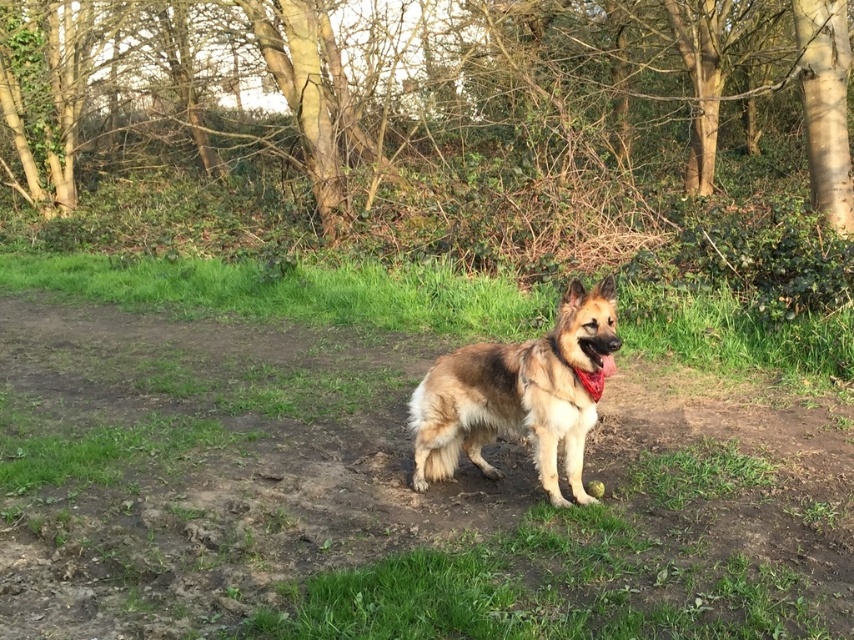
You are a hiker who wants to take a photo of the German Shepherd dog in the park. You are currently standing at point (430, 99). Which direction should you move to get a better view of the dog?

The German Shepherd dog is positioned on a patch of dirt surrounded by grass, while the point (430, 99) is where the brown bark tree at center is located. To get a better view of the dog, you should move away from the brown bark tree at center towards the dog.

You are a dog owner who wants to ensure your brown fur dog at center stays cool. Since the green grass at center is above the dog, where should you place the dog to avoid direct sunlight?

The green grass at center is above the brown fur dog at center, so placing the dog under the green grass at center would provide shade and help keep it cool.